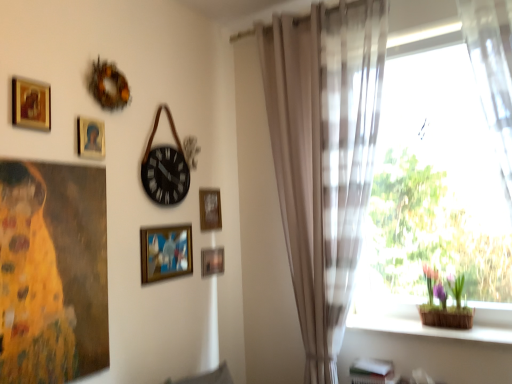
What do you see at coordinates (91, 138) in the screenshot? I see `gold-framed portrait at upper left, which is the second picture frame in front-to-back order` at bounding box center [91, 138].

What is the approximate height of gold-framed portrait at upper left, which is the second picture frame in front-to-back order?

The height of gold-framed portrait at upper left, which is the second picture frame in front-to-back order, is 7.02 inches.

At what (x,y) coordinates should I click in order to perform the action: click on green leafy plant at right. Please return your answer as a coordinate pair (x, y). The image size is (512, 384). Looking at the image, I should click on (445, 303).

The image size is (512, 384). Describe the element at coordinates (165, 175) in the screenshot. I see `black matte clock at upper center` at that location.

Measure the distance between point (200,200) and camera.

Point (200,200) is 8.37 feet from camera.

The width and height of the screenshot is (512, 384). In order to click on wooden frame at upper center, the fifth picture frame from the front in this screenshot , I will do `click(210, 209)`.

This screenshot has width=512, height=384. Find the location of `gold-framed portrait at upper left, which is the second picture frame in front-to-back order`. gold-framed portrait at upper left, which is the second picture frame in front-to-back order is located at coordinates (91, 138).

Which is closer to the camera, (435, 151) or (22, 374)?

Point (435, 151).

Can you tell me how much translucent fabric at right and oil painting of woman at left differ in facing direction?

translucent fabric at right and oil painting of woman at left are facing 90 degrees away from each other.

Which of these two, translucent fabric at right or oil painting of woman at left, is wider?

translucent fabric at right.

Consider the image. Measure the distance between wooden frame at center, the 4th picture frame in the top-to-bottom sequence, and gold-framed picture at upper left, placed as the fifth picture frame when sorted from right to left.

wooden frame at center, the 4th picture frame in the top-to-bottom sequence, is 35.96 inches from gold-framed picture at upper left, placed as the fifth picture frame when sorted from right to left.

Starting from the wooden frame at center, the 2th picture frame positioned from the bottom, which picture frame is the 2nd one in front? Please provide its 2D coordinates.

[(31, 104)]

Which point is more forward, (174,235) or (40,114)?

Point (40,114)

Does wooden frame at center, the 2th picture frame positioned from the bottom, turn towards gold-framed picture at upper left, positioned as the fifth picture frame in bottom-to-top order?

No, wooden frame at center, the 2th picture frame positioned from the bottom, is not aimed at gold-framed picture at upper left, positioned as the fifth picture frame in bottom-to-top order.

Considering the points (208, 191) and (206, 274), which point is behind, point (208, 191) or point (206, 274)?

The point (208, 191) is farther.

Identify the location of the 2nd picture frame above the metallic gold picture frame at lower center, which is counted as the 4th picture frame, starting from the front (from the image's perspective). (210, 209).

Can you confirm if wooden frame at upper center, acting as the 4th picture frame starting from the left, is wider than metallic gold picture frame at lower center, which is the 1th picture frame in right-to-left order?

Correct, the width of wooden frame at upper center, acting as the 4th picture frame starting from the left, exceeds that of metallic gold picture frame at lower center, which is the 1th picture frame in right-to-left order.

How distant is oil painting of woman at left from sheer beige curtain at right?

oil painting of woman at left and sheer beige curtain at right are 1.35 meters apart from each other.

From a real-world perspective, which object stands above the other?

From a 3D spatial view, sheer beige curtain at right is above.

Can you tell me how much oil painting of woman at left and sheer beige curtain at right differ in facing direction?

There is a 90-degree angle between the facing directions of oil painting of woman at left and sheer beige curtain at right.

Is oil painting of woman at left bigger than sheer beige curtain at right?

No.

From the image's perspective, relative to gold-framed portrait at upper left, arranged as the fourth picture frame when viewed from the back, is oil painting of woman at left above or below?

oil painting of woman at left is situated lower than gold-framed portrait at upper left, arranged as the fourth picture frame when viewed from the back, in the image.

In the scene shown: Can you confirm if oil painting of woman at left is positioned to the left of gold-framed portrait at upper left, marked as the second picture frame in a top-to-bottom arrangement?

Correct, you'll find oil painting of woman at left to the left of gold-framed portrait at upper left, marked as the second picture frame in a top-to-bottom arrangement.

Is oil painting of woman at left located outside gold-framed portrait at upper left, arranged as the fourth picture frame when viewed from the back?

Yes, oil painting of woman at left is outside of gold-framed portrait at upper left, arranged as the fourth picture frame when viewed from the back.

From a real-world perspective, which picture frame is the 3rd one above the oil painting of woman at left? Please provide its 2D coordinates.

[(91, 138)]

Which is further, (457, 277) or (178, 275)?

The point (178, 275) is more distant.

Considering the sizes of objects green leafy plant at right and wooden frame at center, arranged as the 3th picture frame when viewed from the left, in the image provided, who is bigger, green leafy plant at right or wooden frame at center, arranged as the 3th picture frame when viewed from the left,?

green leafy plant at right is bigger.

Could wooden frame at center, which ranks as the 3th picture frame in back-to-front order, be considered to be inside green leafy plant at right?

Definitely not — wooden frame at center, which ranks as the 3th picture frame in back-to-front order, is not inside green leafy plant at right.

Is wooden basket at lower right far from metallic gold picture frame at lower center, which is counted as the 4th picture frame, starting from the front?

Absolutely, wooden basket at lower right is distant from metallic gold picture frame at lower center, which is counted as the 4th picture frame, starting from the front.

Is point (475, 336) farther from camera compared to point (215, 261)?

That is False.

In terms of width, does wooden basket at lower right look wider or thinner when compared to metallic gold picture frame at lower center, which is the 5th picture frame in left-to-right order?

Considering their sizes, wooden basket at lower right looks broader than metallic gold picture frame at lower center, which is the 5th picture frame in left-to-right order.

Is wooden basket at lower right inside or outside of metallic gold picture frame at lower center, marked as the 5th picture frame in a top-to-bottom arrangement?

wooden basket at lower right is outside metallic gold picture frame at lower center, marked as the 5th picture frame in a top-to-bottom arrangement.

I want to click on window to the right of oil painting of woman at left, so click(x=433, y=197).

At what (x,y) coordinates should I click in order to perform the action: click on the 3rd picture frame located above the wooden frame at center, the 2th picture frame positioned from the bottom (from a real-world perspective). Please return your answer as a coordinate pair (x, y). This screenshot has width=512, height=384. Looking at the image, I should click on (31, 104).

From the image, which object appears to be nearer to gold-framed picture at upper left, the 1th picture frame viewed from the top, wooden frame at center, which ranks as the 3th picture frame in back-to-front order, or wooden basket at lower right?

Based on the image, wooden frame at center, which ranks as the 3th picture frame in back-to-front order, appears to be nearer to gold-framed picture at upper left, the 1th picture frame viewed from the top.

Based on their spatial positions, is wooden frame at upper center, positioned as the 3th picture frame in bottom-to-top order, or green leafy plant at right further from metallic gold picture frame at lower center, marked as the 5th picture frame in a top-to-bottom arrangement?

green leafy plant at right is further to metallic gold picture frame at lower center, marked as the 5th picture frame in a top-to-bottom arrangement.

Which object lies further to the anchor point gold-framed portrait at upper left, marked as the second picture frame in a top-to-bottom arrangement, wooden frame at center, acting as the 3th picture frame starting from the front, or translucent fabric at right?

Among the two, translucent fabric at right is located further to gold-framed portrait at upper left, marked as the second picture frame in a top-to-bottom arrangement.

Based on their spatial positions, is wooden frame at upper center, positioned as the 3th picture frame in bottom-to-top order, or gold-framed portrait at upper left, the fourth picture frame in the right-to-left sequence, closer to translucent fabric at right?

The object closer to translucent fabric at right is wooden frame at upper center, positioned as the 3th picture frame in bottom-to-top order.

Based on the photo, based on their spatial positions, is black matte clock at upper center or gold-framed picture at upper left, the 1th picture frame viewed from the top, closer to wooden basket at lower right?

black matte clock at upper center is closer to wooden basket at lower right.

Which object lies nearer to the anchor point metallic gold picture frame at lower center, marked as the first picture frame in a bottom-to-top arrangement, oil painting of woman at left or green leafy plant at right?

oil painting of woman at left lies closer to metallic gold picture frame at lower center, marked as the first picture frame in a bottom-to-top arrangement, than the other object.

Looking at this image, based on their spatial positions, is wooden frame at center, arranged as the 3th picture frame when viewed from the left, or gold-framed picture at upper left, the 1th picture frame from the left, closer to black matte clock at upper center?

wooden frame at center, arranged as the 3th picture frame when viewed from the left, lies closer to black matte clock at upper center than the other object.

Considering their positions, is wooden basket at lower right positioned further to wooden frame at center, which ranks as the 3th picture frame in back-to-front order, than gold-framed picture at upper left, the 1th picture frame from the left?

wooden basket at lower right is positioned further to the anchor wooden frame at center, which ranks as the 3th picture frame in back-to-front order.

Find the location of a particular element. window between black matte clock at upper center and wooden basket at lower right is located at coordinates (433, 197).

Where is `window sill between oil painting of woman at left and green leafy plant at right in the horizontal direction`? The width and height of the screenshot is (512, 384). window sill between oil painting of woman at left and green leafy plant at right in the horizontal direction is located at coordinates (428, 329).

At what (x,y) coordinates should I click in order to perform the action: click on clock between gold-framed picture at upper left, arranged as the 1th picture frame when viewed from the front, and translucent fabric at right, in the horizontal direction. Please return your answer as a coordinate pair (x, y). Looking at the image, I should click on (165, 175).

This screenshot has height=384, width=512. What are the coordinates of `curtain located between wooden frame at upper center, the fifth picture frame from the front, and translucent fabric at right in the left-right direction` in the screenshot? It's located at (324, 156).